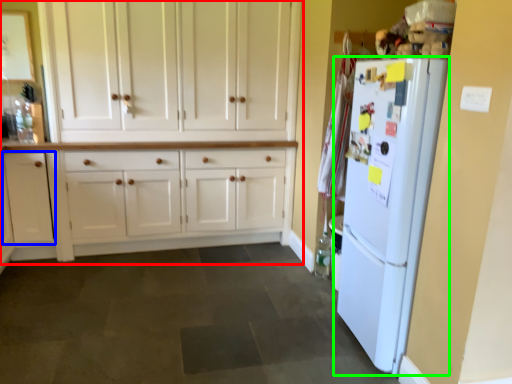
Question: Considering the real-world distances, which object is farthest from cabinetry (highlighted by a red box)? cabinetry (highlighted by a blue box) or refrigerator (highlighted by a green box)?

Choices:
 (A) cabinetry
 (B) refrigerator

Answer: (B)